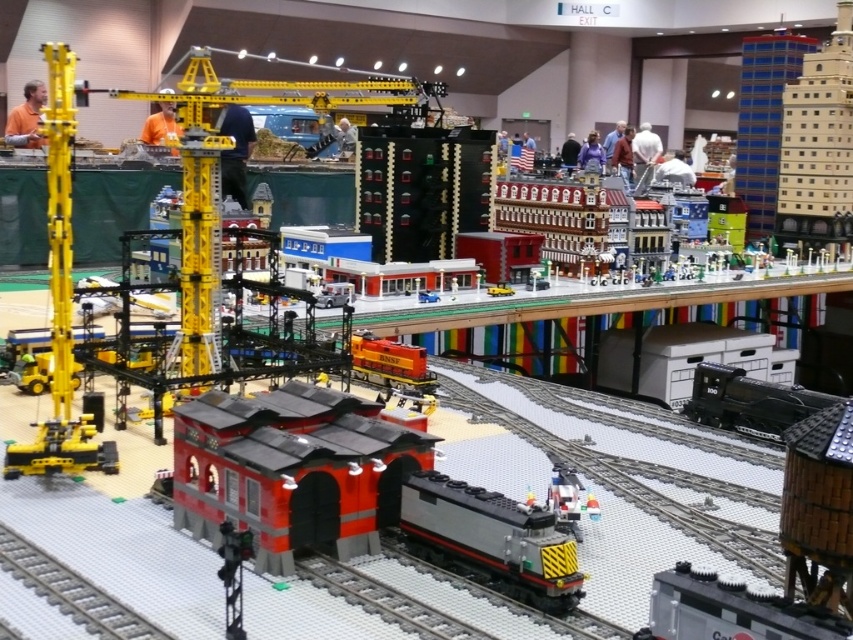
Question: Does metallic silver train at center come in front of yellow plastic crane at left?

Choices:
 (A) no
 (B) yes

Answer: (B)

Question: Where is yellow plastic crane at left located in relation to gray smooth train track at lower left in the image?

Choices:
 (A) right
 (B) left

Answer: (B)

Question: Estimate the real-world distances between objects in this image. Which object is closer to the metallic silver train at center?

Choices:
 (A) yellow plastic crane at left
 (B) gray metallic train at center
 (C) gray smooth train track at lower left

Answer: (B)

Question: Among these points, which one is farthest from the camera?

Choices:
 (A) (349, 508)
 (B) (91, 600)
 (C) (511, 516)

Answer: (A)

Question: Does yellow plastic crane at left have a greater width compared to metallic silver train at bottom right?

Choices:
 (A) no
 (B) yes

Answer: (B)

Question: Among these objects, which one is farthest from the camera?

Choices:
 (A) gray metallic train at center
 (B) metallic silver train at bottom right

Answer: (A)